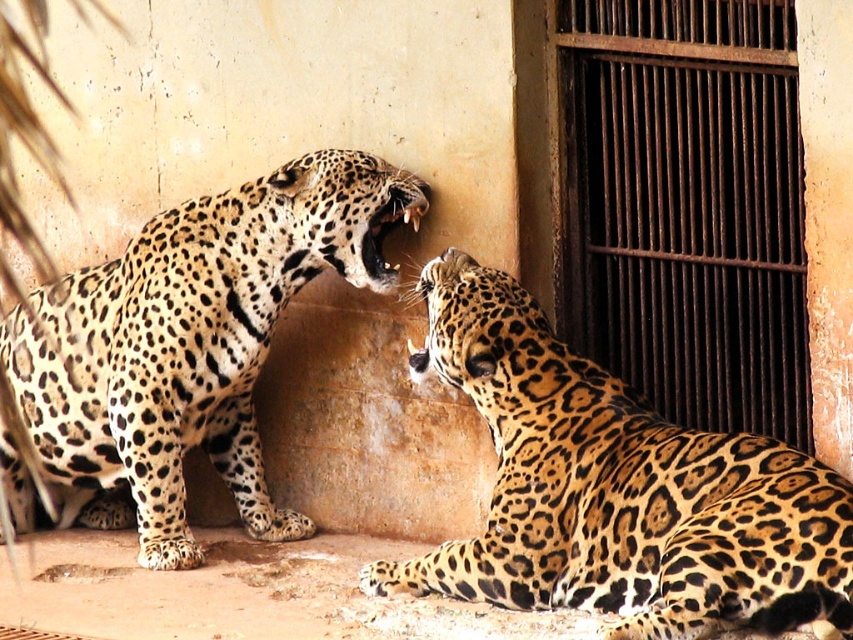
You are a zookeeper who needs to ensure that both spotted fur leopard at lower right and spotted fur jaguar at left have enough space to move comfortably. Given their sizes, which one requires a wider area to accommodate its size?

The spotted fur leopard at lower right requires a wider area because its width is larger than the spotted fur jaguar at left.

You are a zookeeper observing two jaguars in their enclosure. You notice two specific points marked in the image. The first point is at coordinate point (572, 564) and the second is at point (148, 458). From your vantage point, which of these two points is closer to you?

Point (572, 564) is in front of point (148, 458), so it is closer to you.

You are a zookeeper observing the jaguars in their enclosure. You notice the spotted fur leopard at lower right and the spotted fur jaguar at left. Which of these two animals is bigger in size?

The spotted fur leopard at lower right is larger in size compared to the spotted fur jaguar at left.